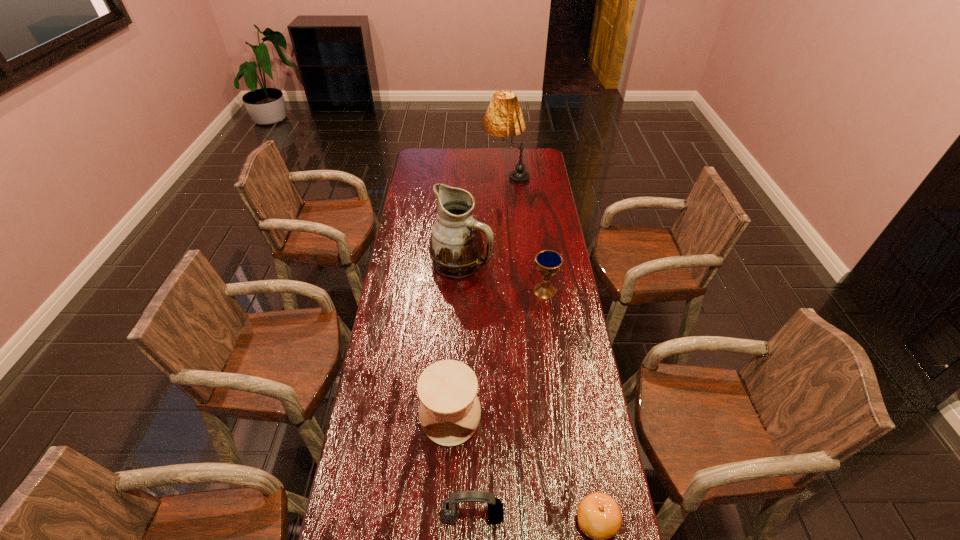
Find the location of a particular element. Image resolution: width=960 pixels, height=540 pixels. lampshade is located at coordinates (504, 118).

The width and height of the screenshot is (960, 540). Find the location of `the tallest object`. the tallest object is located at coordinates (504, 118).

Find the location of a particular element. The height and width of the screenshot is (540, 960). pitcher is located at coordinates (456, 248).

At what (x,y) coordinates should I click in order to perform the action: click on pottery. Please return your answer as a coordinate pair (x, y). Looking at the image, I should click on (449, 412).

You are a GUI agent. You are given a task and a screenshot of the screen. Output one action in this format:
    pyautogui.click(x=<x>, y=<y>)
    Task: Click on the fourth farthest object
    
    Given the screenshot: What is the action you would take?
    pyautogui.click(x=449, y=412)

The height and width of the screenshot is (540, 960). In order to click on chalice in this screenshot , I will do `click(548, 262)`.

The width and height of the screenshot is (960, 540). In order to click on the fifth tallest object in this screenshot , I will do `click(449, 507)`.

Where is `vacant space located on the front-facing side of the farthest object`? vacant space located on the front-facing side of the farthest object is located at coordinates (455, 175).

Where is `vacant space located on the front-facing side of the farthest object`? The image size is (960, 540). vacant space located on the front-facing side of the farthest object is located at coordinates (416, 175).

This screenshot has height=540, width=960. I want to click on free space located on the front-facing side of the farthest object, so click(x=434, y=175).